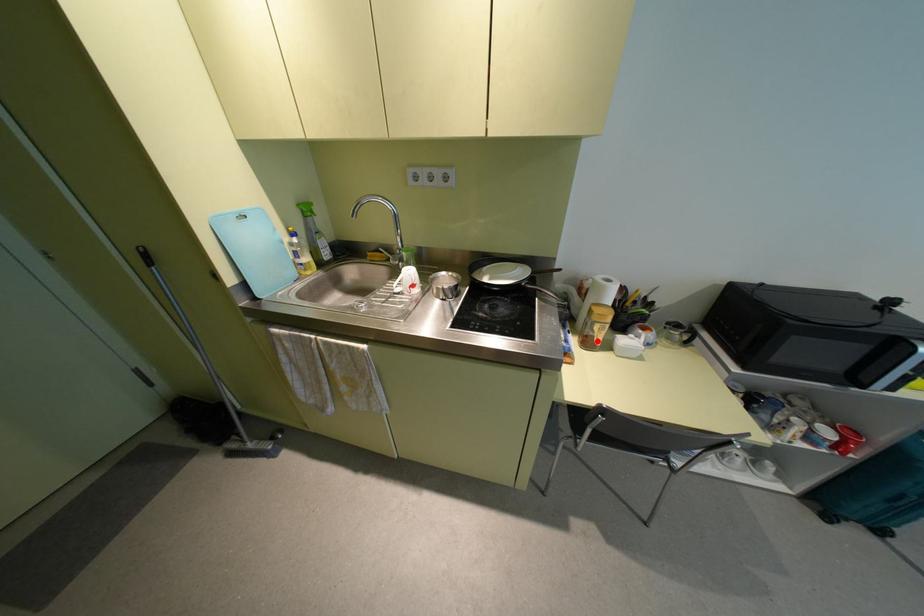
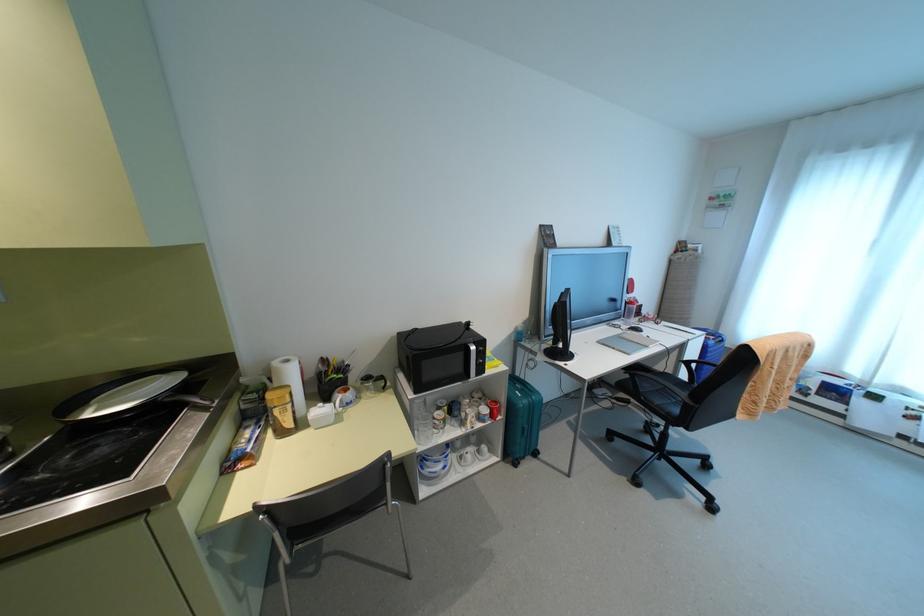
Question: I am providing you with two images of the same scene from different viewpoints. A red point is marked on the first image. Can you still see the location of the red point in image 2?

Choices:
 (A) Yes
 (B) No

Answer: (A)